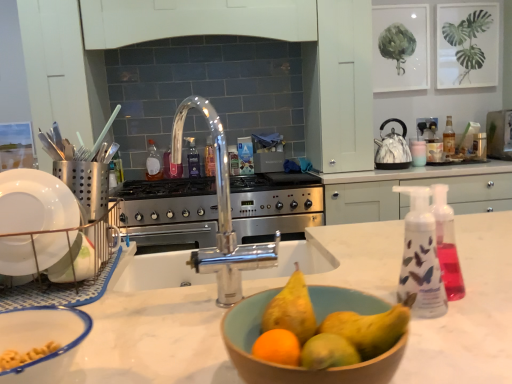
Question: Does metallic silver toaster at upper right, marked as the first appliance in a right-to-left arrangement, lie behind yellow matte pear at center, the 1th pear viewed from the right?

Choices:
 (A) no
 (B) yes

Answer: (B)

Question: Is metallic silver toaster at upper right, the second appliance ordered from the bottom, looking in the opposite direction of yellow matte pear at center, the 1th pear viewed from the right?

Choices:
 (A) yes
 (B) no

Answer: (B)

Question: Is metallic silver toaster at upper right, which is counted as the second appliance, starting from the front, closer to camera compared to yellow matte pear at center, which is the second pear in left-to-right order?

Choices:
 (A) yes
 (B) no

Answer: (B)

Question: Does metallic silver toaster at upper right, the first appliance from the top, have a smaller size compared to yellow matte pear at center, which is the second pear in left-to-right order?

Choices:
 (A) yes
 (B) no

Answer: (B)

Question: Is metallic silver toaster at upper right, the 2th appliance when ordered from left to right, completely or partially outside of yellow matte pear at center, which is the second pear in left-to-right order?

Choices:
 (A) no
 (B) yes

Answer: (B)

Question: From a real-world perspective, is metallic silver toaster at upper right, the second appliance ordered from the bottom, located higher than yellow matte pear at center, the 1th pear viewed from the right?

Choices:
 (A) yes
 (B) no

Answer: (A)

Question: Is the depth of yellow matte pear at center, the first pear positioned from the left, less than that of wooden bowl at center, marked as the first basin in a right-to-left arrangement?

Choices:
 (A) no
 (B) yes

Answer: (A)

Question: Is the surface of yellow matte pear at center, the first pear positioned from the left, in direct contact with wooden bowl at center, marked as the first basin in a right-to-left arrangement?

Choices:
 (A) yes
 (B) no

Answer: (A)

Question: Is yellow matte pear at center, the second pear from the right, not within wooden bowl at center, marked as the first basin in a right-to-left arrangement?

Choices:
 (A) yes
 (B) no

Answer: (B)

Question: Can you confirm if yellow matte pear at center, the first pear positioned from the left, is thinner than wooden bowl at center, marked as the first basin in a right-to-left arrangement?

Choices:
 (A) yes
 (B) no

Answer: (A)

Question: Does yellow matte pear at center, the first pear positioned from the left, have a larger size compared to wooden bowl at center, which ranks as the 2th basin in left-to-right order?

Choices:
 (A) no
 (B) yes

Answer: (A)

Question: Is yellow matte pear at center, the second pear from the right, to the right of wooden bowl at center, which ranks as the 2th basin in left-to-right order, from the viewer's perspective?

Choices:
 (A) no
 (B) yes

Answer: (A)

Question: Does satin silver utensil holder at left, the 2th appliance viewed from the top, come behind marble-patterned kettle at right, which ranks as the 2th kitchen appliance in left-to-right order?

Choices:
 (A) no
 (B) yes

Answer: (A)